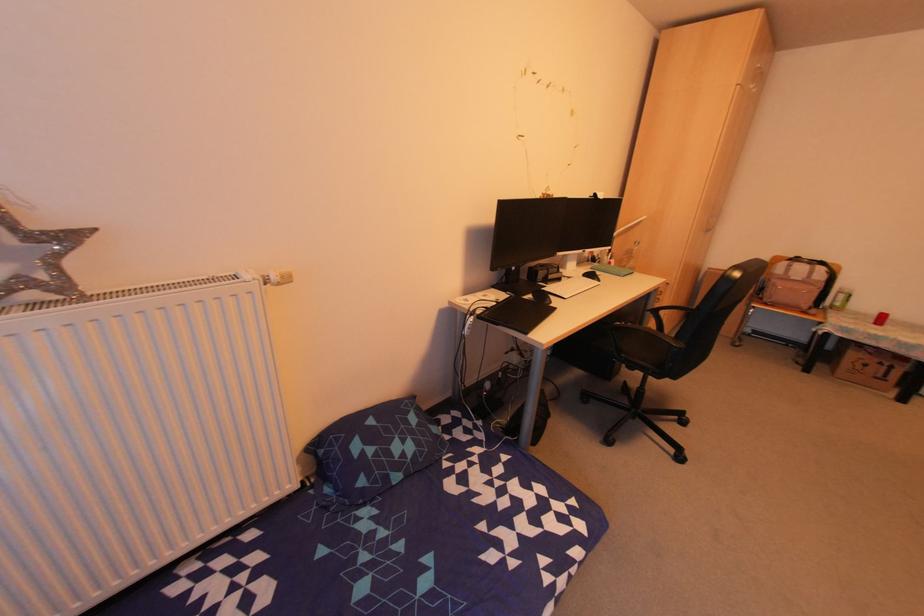
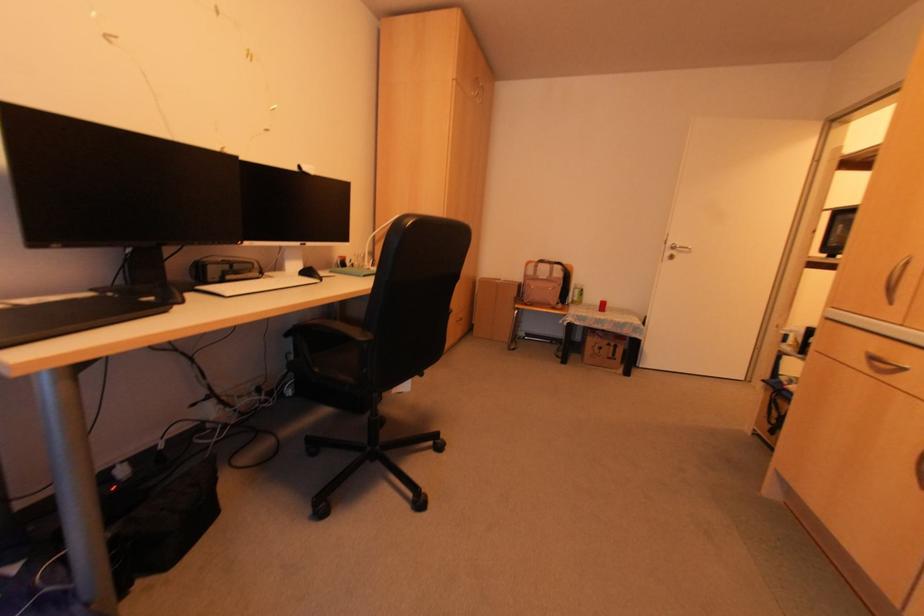
Which direction would the cameraman need to move to produce the second image?

The movement direction of the cameraman is right, forward.